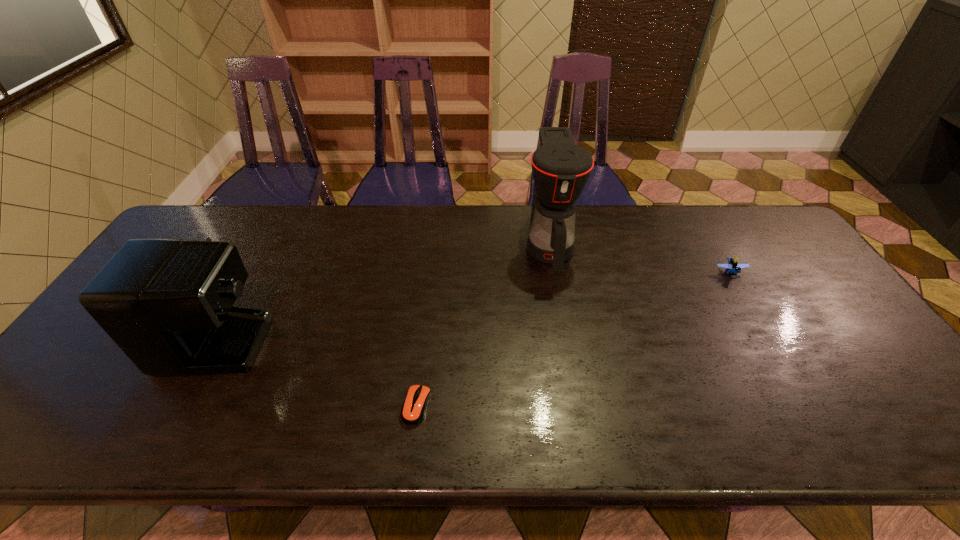
Where is `the taller coffee maker`? This screenshot has height=540, width=960. the taller coffee maker is located at coordinates (560, 168).

You are a GUI agent. You are given a task and a screenshot of the screen. Output one action in this format:
    pyautogui.click(x=<x>, y=<y>)
    Task: Click on the third object from left to right
    The height and width of the screenshot is (540, 960).
    Given the screenshot: What is the action you would take?
    pyautogui.click(x=560, y=168)

Identify the location of the leftmost object. Image resolution: width=960 pixels, height=540 pixels. (167, 303).

Where is `the shorter coffee maker`? This screenshot has height=540, width=960. the shorter coffee maker is located at coordinates (167, 303).

Identify the location of the rightmost object. (733, 266).

At what (x,y) coordinates should I click in order to perform the action: click on Lego. Please return your answer as a coordinate pair (x, y). Image resolution: width=960 pixels, height=540 pixels. Looking at the image, I should click on (733, 266).

The width and height of the screenshot is (960, 540). Find the location of `the nearest object`. the nearest object is located at coordinates (413, 409).

This screenshot has width=960, height=540. I want to click on computer mouse, so click(x=413, y=409).

In order to click on vacant space located 0.340m pour from the carafe of the right coffee maker in this screenshot , I will do `click(573, 383)`.

You are a GUI agent. You are given a task and a screenshot of the screen. Output one action in this format:
    pyautogui.click(x=<x>, y=<y>)
    Task: Click on the vacant area situated 0.320m on the front-facing side of the left coffee maker
    The image size is (960, 540).
    Given the screenshot: What is the action you would take?
    pyautogui.click(x=420, y=302)